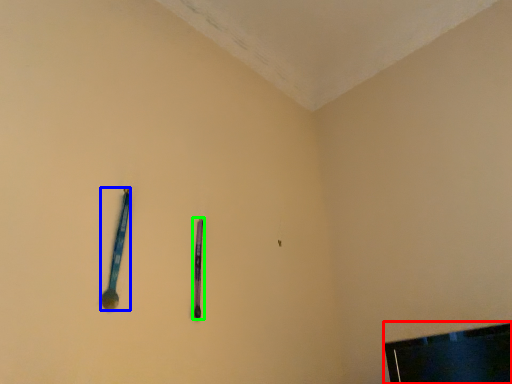
Question: Which object is positioned farthest from television (highlighted by a red box)? Select from spoon (highlighted by a blue box) and writing (highlighted by a green box).

Choices:
 (A) spoon
 (B) writing

Answer: (A)